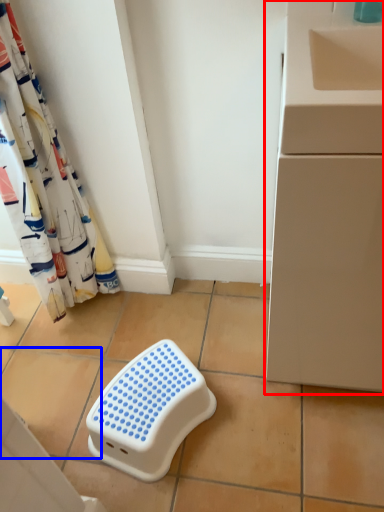
Question: Which object is further to the camera taking this photo, counter (highlighted by a red box) or ceramic tile (highlighted by a blue box)?

Choices:
 (A) counter
 (B) ceramic tile

Answer: (B)